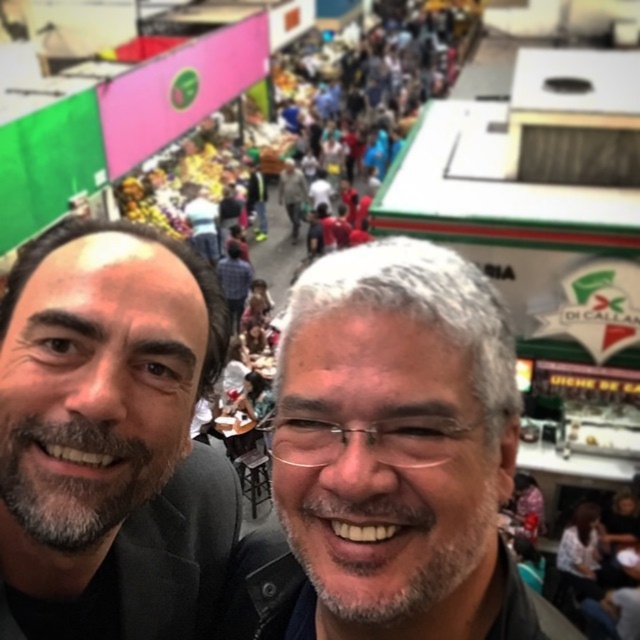
You are standing at the point with coordinates point (72, 220) and want to walk towards the point with coordinates point (339, 568). Which direction should you move relative to the market scene?

You should move forward because point (339, 568) is in front of point (72, 220) in the market scene.

You are a photographer standing at the edge of the market. You want to take a photo that includes both the gray hair at center and the smooth black suit at left. What is the minimum distance you need to move backward to ensure both subjects are in frame?

The gray hair at center and smooth black suit at left are 3.29 meters apart. To include both in the frame, you need to move back until the camera can capture a field of view wide enough to encompass 3.29 meters between them. The exact distance depends on the camera lens, but generally, a few meters back would suffice.

You are a photographer at the market and want to take a photo of the gray hair at center and the smooth black suit at left. Which one is positioned to the right side of the other?

The gray hair at center is to the right of the smooth black suit at left.